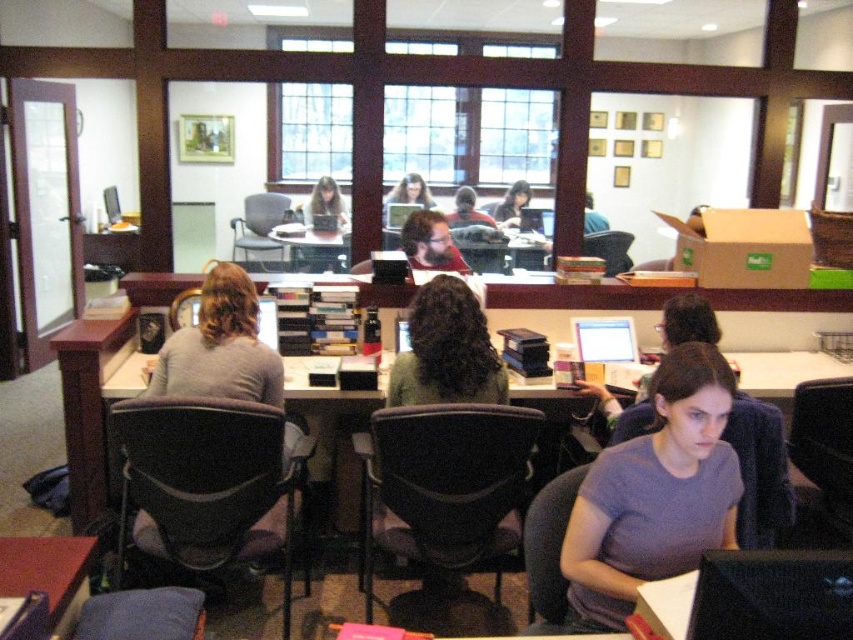
Is point (650, 452) positioned after point (514, 192)?

No, (650, 452) is closer to viewer.

Which of these two, purple matte shirt at center or matte black hair at center, stands shorter?

matte black hair at center

Locate an element on the screen. purple matte shirt at center is located at coordinates (656, 492).

Is purple matte shirt at center below wooden desk at lower left?

Actually, purple matte shirt at center is above wooden desk at lower left.

You are a GUI agent. You are given a task and a screenshot of the screen. Output one action in this format:
    pyautogui.click(x=<x>, y=<y>)
    Task: Click on the purple matte shirt at center
    
    Given the screenshot: What is the action you would take?
    pyautogui.click(x=656, y=492)

What do you see at coordinates (656, 492) in the screenshot? I see `purple matte shirt at center` at bounding box center [656, 492].

Locate an element on the screen. This screenshot has height=640, width=853. purple matte shirt at center is located at coordinates (656, 492).

Does white plastic table at center have a smaller size compared to matte black laptop at center?

Actually, white plastic table at center might be larger than matte black laptop at center.

Is point (294, 250) farther from viewer compared to point (303, 205)?

That is True.

Where is `white plastic table at center`? This screenshot has width=853, height=640. white plastic table at center is located at coordinates (311, 248).